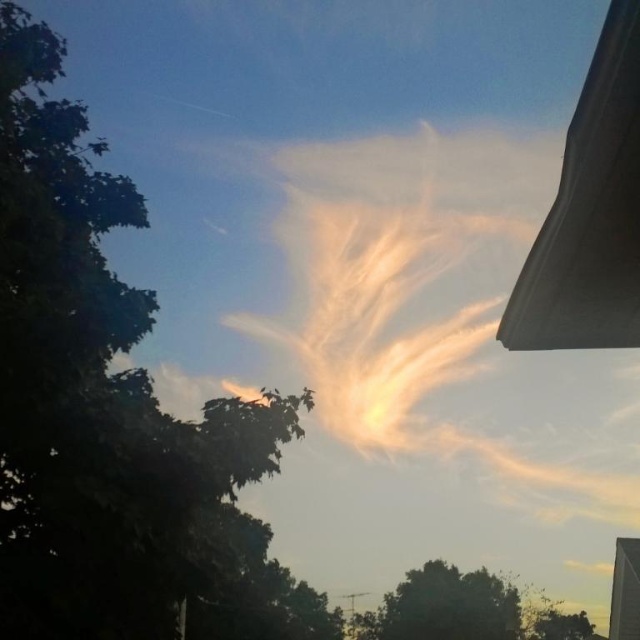
Question: Which point appears closest to the camera in this image?

Choices:
 (A) (179, 420)
 (B) (512, 618)

Answer: (A)

Question: Is green leafy tree at left to the left of translucent cotton cloud at center from the viewer's perspective?

Choices:
 (A) yes
 (B) no

Answer: (A)

Question: In this image, where is green leafy tree at left located relative to translucent cotton cloud at center?

Choices:
 (A) below
 (B) above

Answer: (A)

Question: Which object is farther from the camera taking this photo?

Choices:
 (A) green leafy tree at left
 (B) translucent cotton cloud at center
 (C) green leafy tree at lower center

Answer: (B)

Question: Can you confirm if translucent cotton cloud at center is positioned below green leafy tree at lower center?

Choices:
 (A) no
 (B) yes

Answer: (A)

Question: Which point is farther to the camera?

Choices:
 (A) (65, 506)
 (B) (412, 253)
 (C) (438, 625)

Answer: (B)